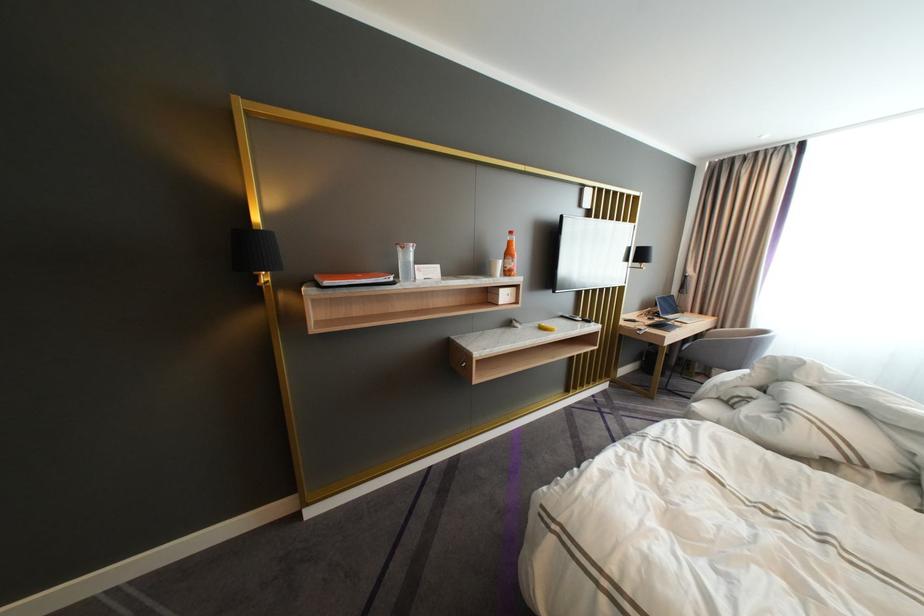
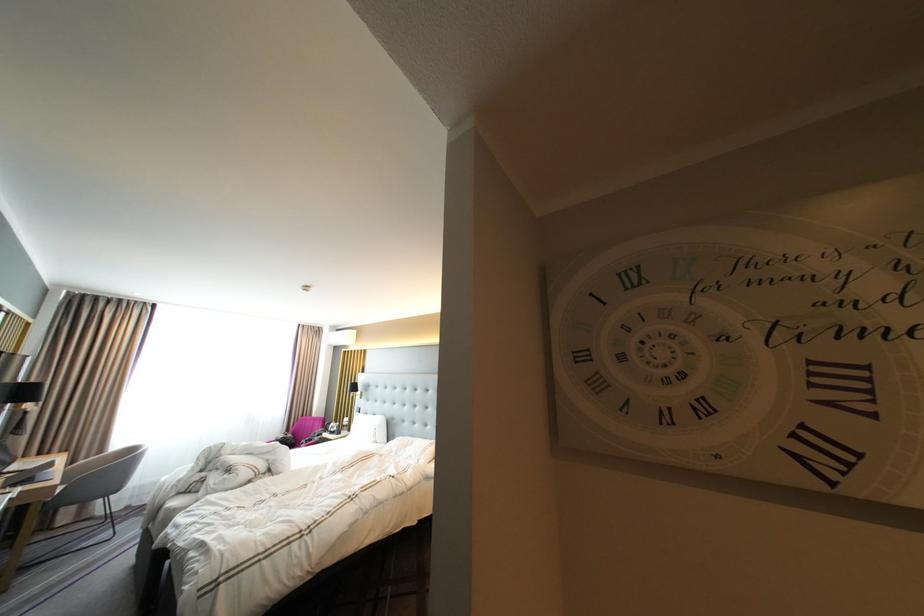
Find the pixel in the second image that matches point (683, 317) in the first image.

(27, 468)